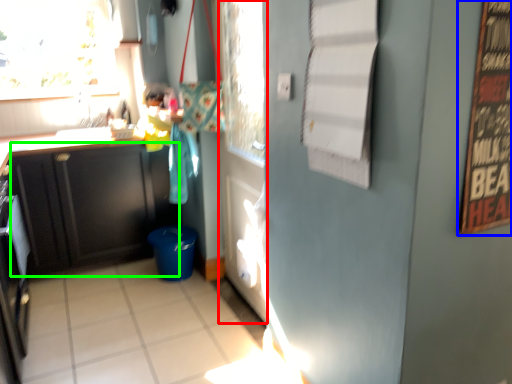
Question: Which is farther away from door (highlighted by a red box)? bulletin board (highlighted by a blue box) or cabinetry (highlighted by a green box)?

Choices:
 (A) bulletin board
 (B) cabinetry

Answer: (A)